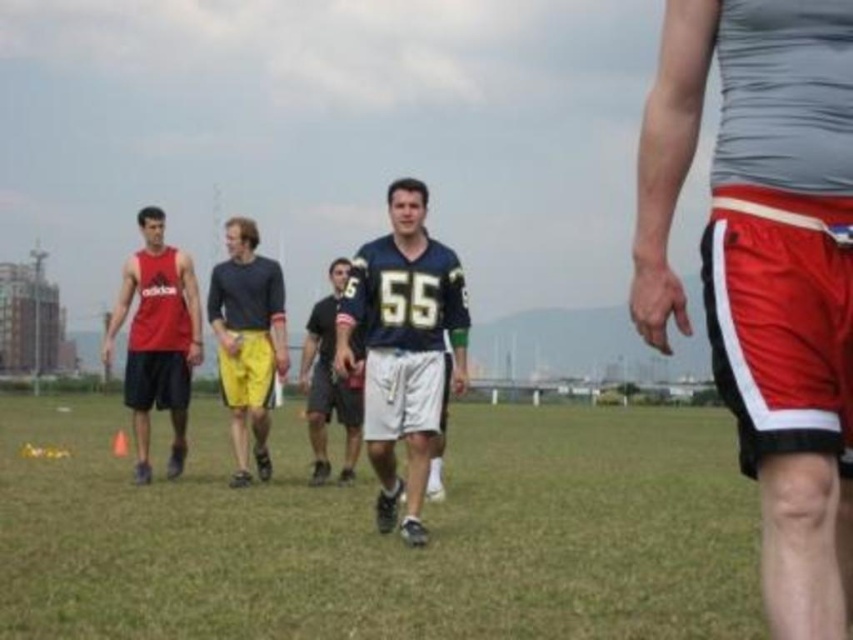
Does green grass at center have a greater width compared to red shiny shorts at center?

Indeed, green grass at center has a greater width compared to red shiny shorts at center.

Which is behind, point (62, 410) or point (770, 540)?

Point (62, 410)

What do you see at coordinates (381, 536) in the screenshot? I see `green grass at center` at bounding box center [381, 536].

Where is `green grass at center`? green grass at center is located at coordinates (381, 536).

Looking at this image, does red shiny shorts at center come in front of matte red tank top at left?

Yes, red shiny shorts at center is in front of matte red tank top at left.

Can you confirm if red shiny shorts at center is thinner than matte red tank top at left?

No, red shiny shorts at center is not thinner than matte red tank top at left.

Where is `red shiny shorts at center`? Image resolution: width=853 pixels, height=640 pixels. red shiny shorts at center is located at coordinates (766, 269).

Can you confirm if blue jersey at center is positioned below dark blue jersey at center?

No, blue jersey at center is not below dark blue jersey at center.

Which is more to the right, blue jersey at center or dark blue jersey at center?

blue jersey at center

Between point (404, 324) and point (360, 355), which one is positioned in front?

Positioned in front is point (404, 324).

At what (x,y) coordinates should I click in order to perform the action: click on blue jersey at center. Please return your answer as a coordinate pair (x, y). The image size is (853, 640). Looking at the image, I should click on (403, 348).